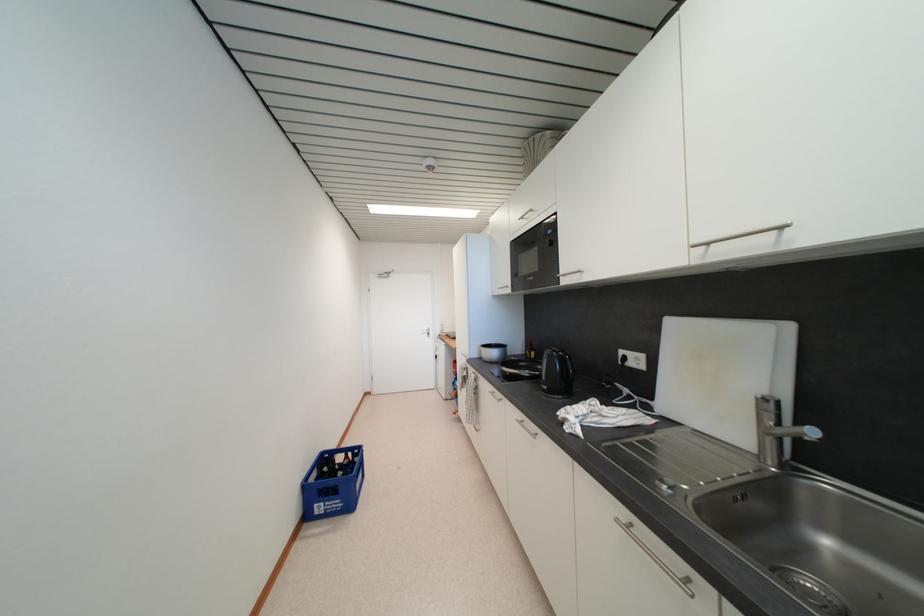
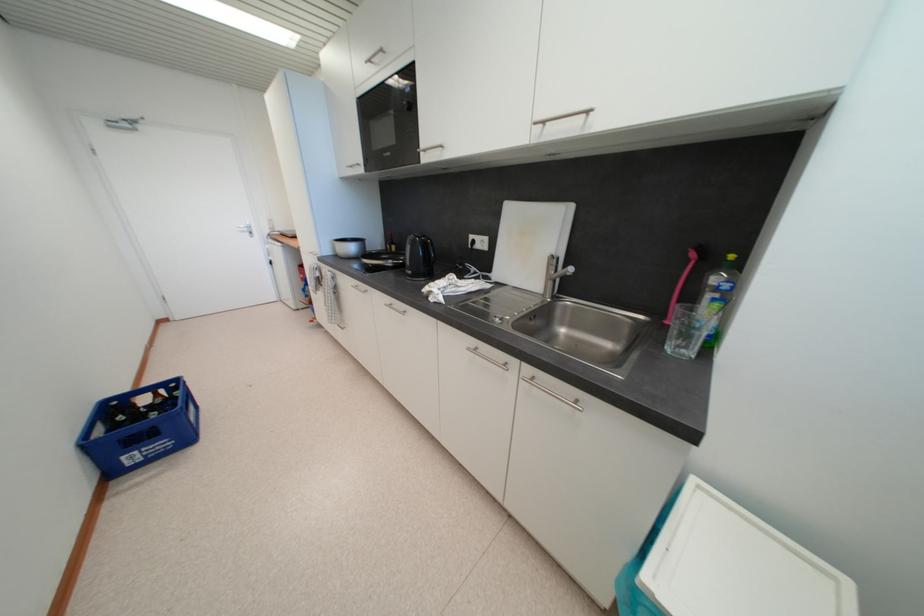
The point at (499,357) is marked in the first image. Where is the corresponding point in the second image?

(357, 251)